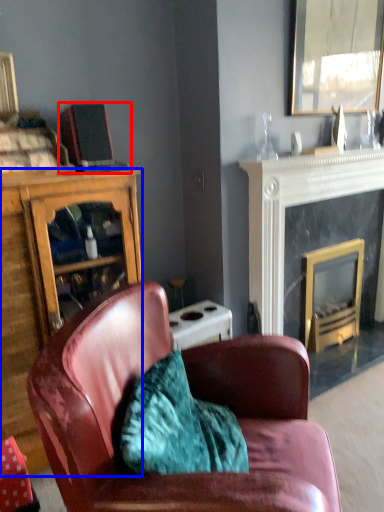
Question: Which of the following is the closest to the observer, laptop (highlighted by a red box) or cabinetry (highlighted by a blue box)?

Choices:
 (A) laptop
 (B) cabinetry

Answer: (B)